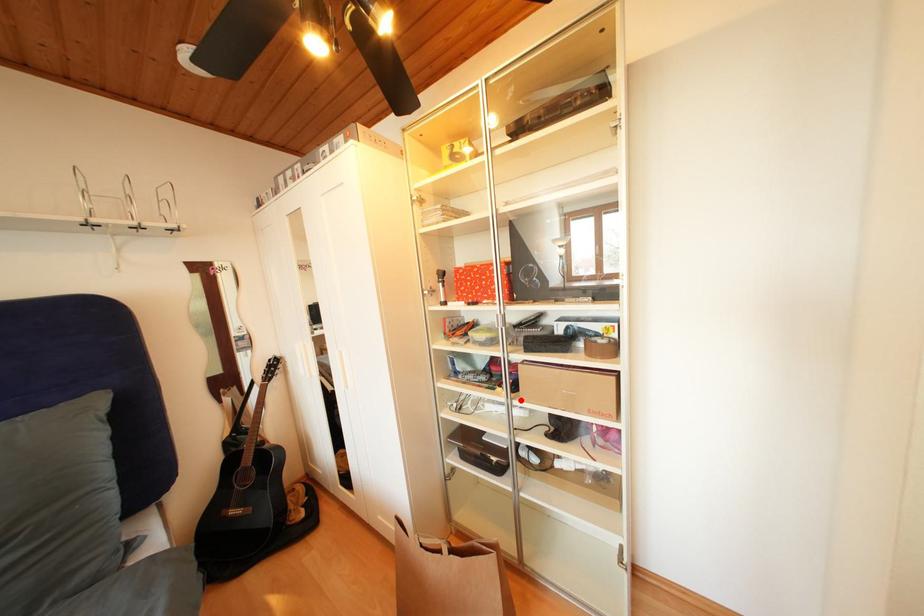
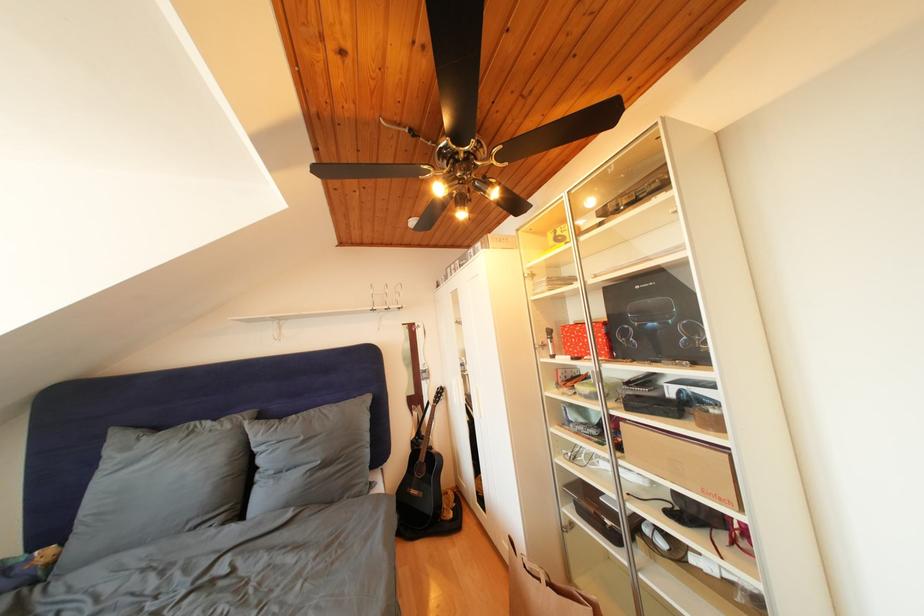
The point at the highlighted location is marked in the first image. Where is the corresponding point in the second image?

(626, 459)